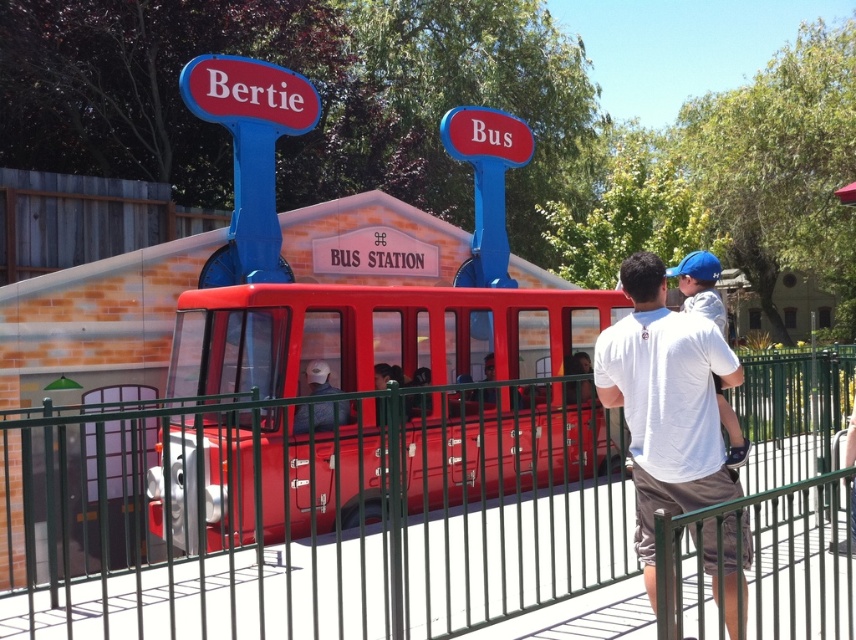
You are a visitor at the amusement park and want to take a photo of the green metal fence at center and the matte black helmet at center. Which object should you focus on first if you want to capture both in a single frame without moving the camera?

The green metal fence at center is larger in size than the matte black helmet at center, so you should focus on the larger object first to ensure both fit in the frame.

You are standing in the amusement park and want to take a photo of the green metal fence at center from a safe distance. According to the park guidelines, visitors must stay at least 5 meters away from all fences for safety. Can you safely take the photo while complying with the rule?

The distance between you and the green metal fence at center is 5.10 meters, which is more than the required 5 meters. Therefore, you can safely take the photo while complying with the park guidelines.